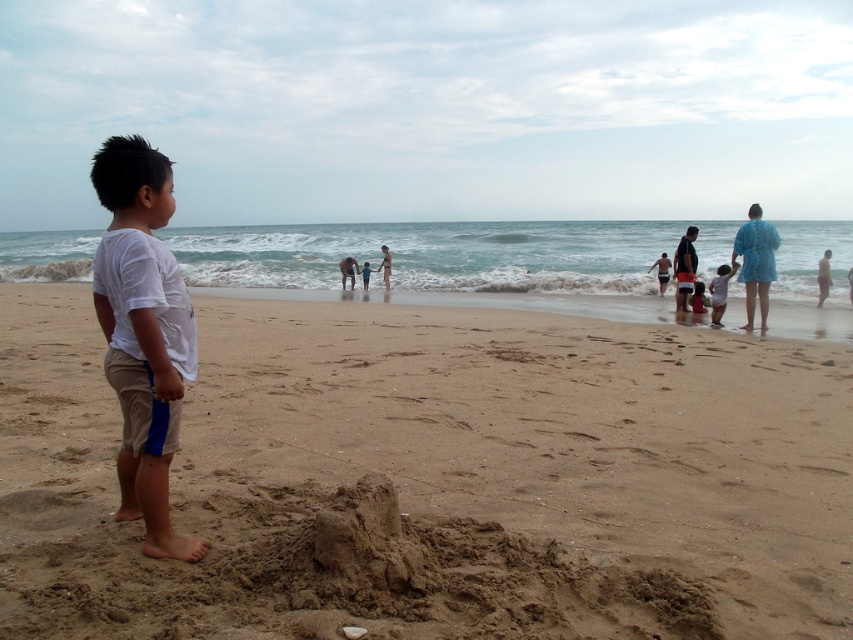
You are a photographer trying to capture a photo of the beach scene. You want to ensure both the matte pink shorts at lower right and the blue fabric swimsuit at center are clearly visible. Given their sizes, which object might require you to adjust your camera focus more carefully to avoid blurriness?

The blue fabric swimsuit at center is smaller in size compared to the matte pink shorts at lower right, so it might require more careful focus adjustment to ensure clarity in the photo.

You are a photographer trying to capture a shot of the beach scene. You notice the matte pink shorts at lower right and the blue fabric swimsuit at center. Which object should you focus on if you want to include the wider one in your photo?

The matte pink shorts at lower right should be focused on because its width surpasses that of the blue fabric swimsuit at center.